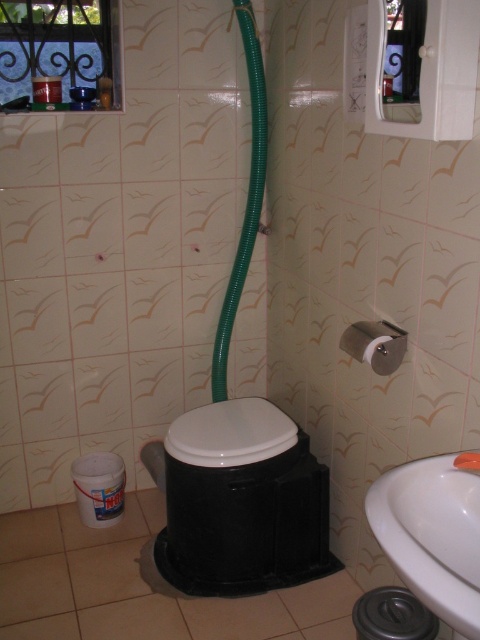
Question: Is black plastic toilet at lower center closer to the viewer compared to white matte toilet lid at center?

Choices:
 (A) yes
 (B) no

Answer: (B)

Question: Which point appears farthest from the camera in this image?

Choices:
 (A) (253, 115)
 (B) (412, 464)

Answer: (A)

Question: Where is white matte toilet lid at center located in relation to green rubber hose at center in the image?

Choices:
 (A) above
 (B) below

Answer: (B)

Question: Which of the following is the farthest from the observer?

Choices:
 (A) black plastic toilet at lower center
 (B) green rubber hose at center
 (C) white ceramic faucet at lower right
 (D) white glossy sink at lower right

Answer: (B)

Question: Is white matte toilet lid at center further to the viewer compared to white ceramic faucet at lower right?

Choices:
 (A) yes
 (B) no

Answer: (A)

Question: Based on their relative distances, which object is nearer to the black plastic toilet at lower center?

Choices:
 (A) white glossy sink at lower right
 (B) white matte toilet lid at center

Answer: (B)